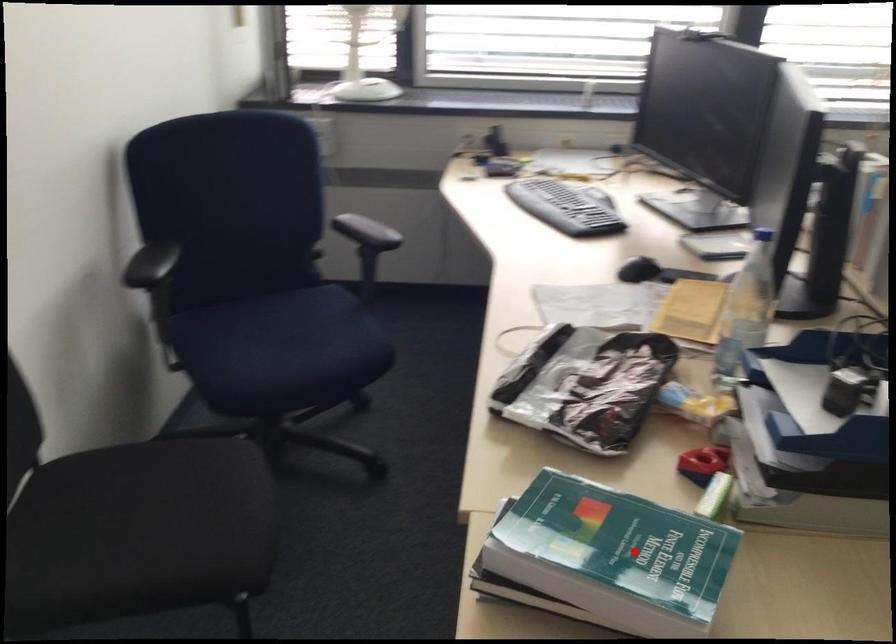
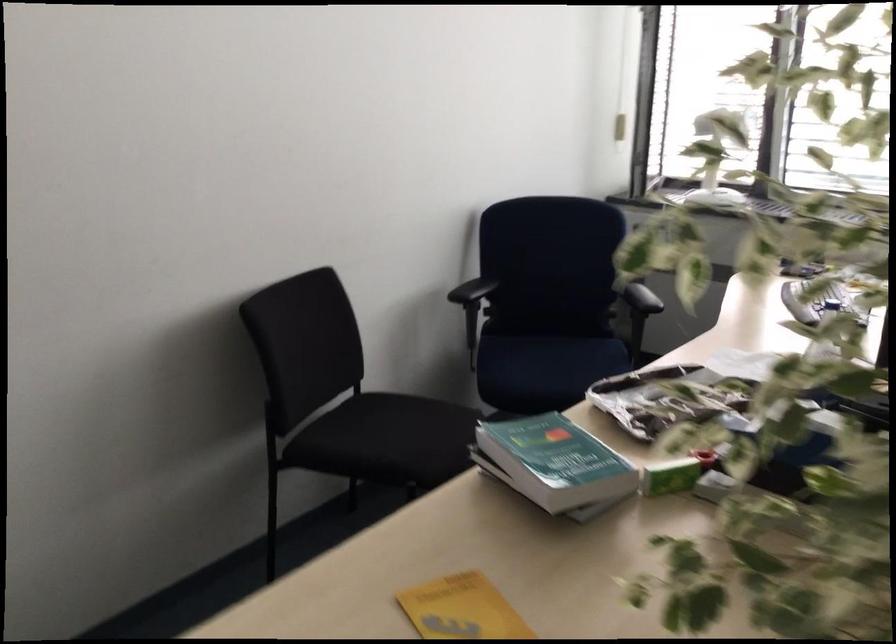
Question: I am providing you with two images of the same scene from different viewpoints. A red point is shown in image1. For the corresponding object point in image2, is it positioned nearer or farther from the camera?

Choices:
 (A) Nearer
 (B) Farther

Answer: (B)